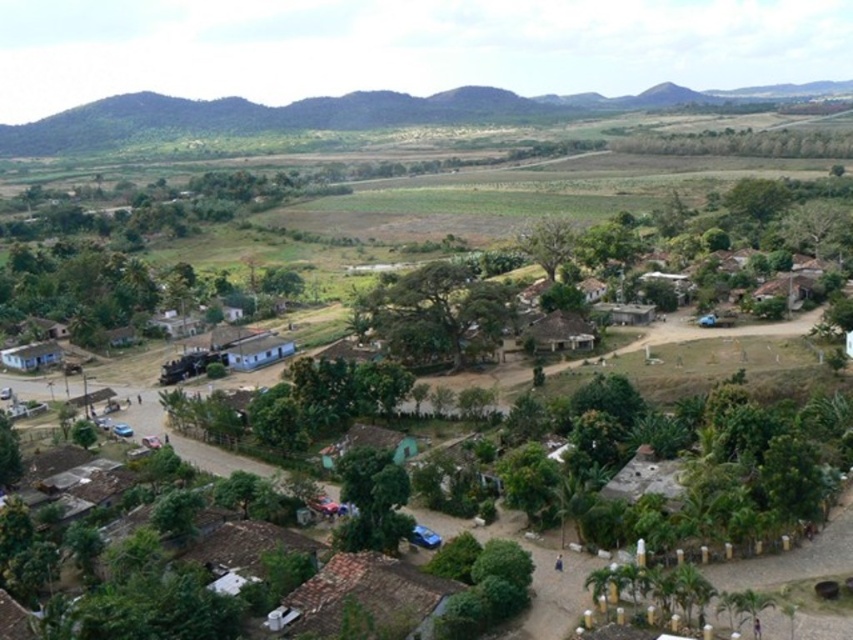
Question: Does brown tiled roof at lower center have a larger size compared to brown corrugated metal hut at center?

Choices:
 (A) no
 (B) yes

Answer: (A)

Question: Does brown tiled roof at lower center appear on the left side of white matte hut at lower left?

Choices:
 (A) no
 (B) yes

Answer: (A)

Question: Can you confirm if brown thatched roof hut at center is positioned to the left of white matte hut at center?

Choices:
 (A) yes
 (B) no

Answer: (B)

Question: Estimate the real-world distances between objects in this image. Which object is closer to the brown corrugated metal hut at center?

Choices:
 (A) white matte hut at lower left
 (B) brown tiled roof at lower center
 (C) brown thatched roof hut at center
 (D) white matte hut at center

Answer: (C)

Question: Among these points, which one is farthest from the camera?

Choices:
 (A) (386, 608)
 (B) (57, 364)

Answer: (B)

Question: Among these points, which one is nearest to the camera?

Choices:
 (A) (236, 365)
 (B) (616, 301)
 (C) (329, 572)

Answer: (C)